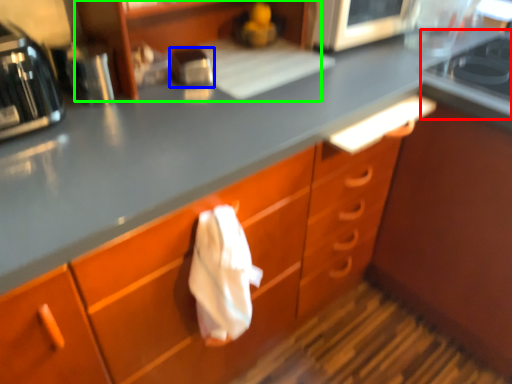
Question: Considering the real-world distances, which object is farthest from gas stove (highlighted by a red box)? kitchen appliance (highlighted by a blue box) or shelf (highlighted by a green box)?

Choices:
 (A) kitchen appliance
 (B) shelf

Answer: (A)